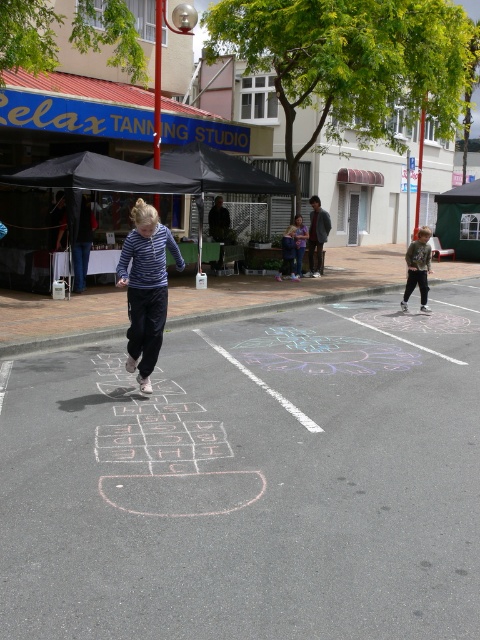
Question: From the image, what is the correct spatial relationship of camouflage jacket at right in relation to light blue denim pants at center?

Choices:
 (A) right
 (B) left

Answer: (A)

Question: Which point is farther to the camera?

Choices:
 (A) light brown hair at center
 (B) light blue denim pants at center
 (C) camouflage jacket at right

Answer: (A)

Question: Which point is farther to the camera?

Choices:
 (A) light brown hair at center
 (B) white chalk hopscotch at center
 (C) light blue denim pants at center
 (D) camouflage jacket at right

Answer: (A)

Question: Estimate the real-world distances between objects in this image. Which object is farther from the camouflage jacket at right?

Choices:
 (A) light brown hair at center
 (B) light blue denim pants at center
 (C) white chalk hopscotch at center

Answer: (C)

Question: Considering the relative positions of camouflage jacket at right and light blue denim pants at center in the image provided, where is camouflage jacket at right located with respect to light blue denim pants at center?

Choices:
 (A) left
 (B) right

Answer: (B)

Question: Can you confirm if camouflage jacket at right is bigger than light blue denim pants at center?

Choices:
 (A) yes
 (B) no

Answer: (B)